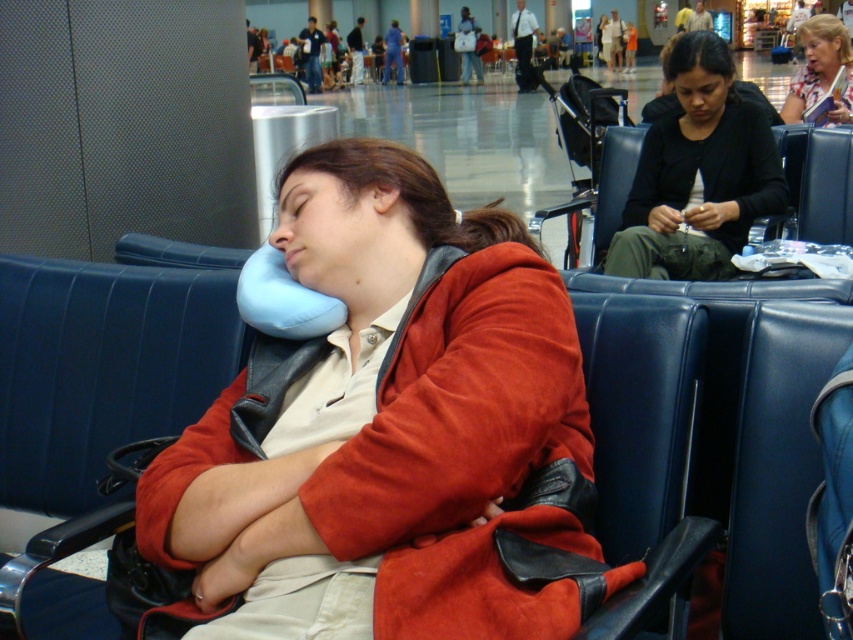
You are a security guard in the airport terminal. You need to locate the black matte jacket at center. Where is it located in terms of coordinates?

The black matte jacket at center is located at coordinates point [698,173].

You are standing in the airport terminal and want to take a photo of both the person resting on the blue bench and the other people in the background. Which point, point (x=323, y=545) or point (x=722, y=77), should you focus on to ensure both the foreground and background are in focus?

You should focus on point (x=722, y=77) because it is further away from the camera, allowing both the closer foreground subject and the background to be in focus.